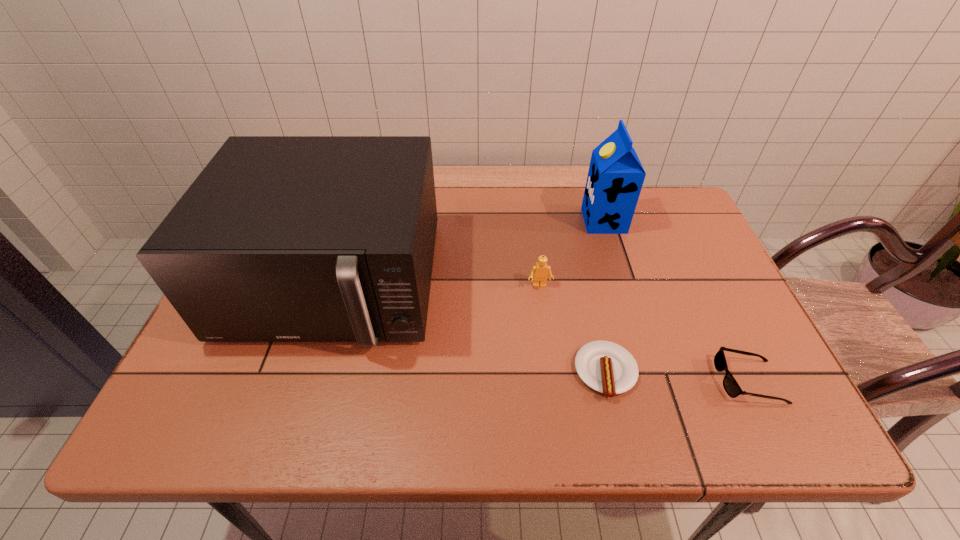
You are a GUI agent. You are given a task and a screenshot of the screen. Output one action in this format:
    pyautogui.click(x=<x>, y=<y>)
    Task: Click on the free location located on the front-facing side of the leftmost object
    
    Given the screenshot: What is the action you would take?
    pyautogui.click(x=302, y=383)

Where is `free space located on the face of the third tallest object`? Image resolution: width=960 pixels, height=540 pixels. free space located on the face of the third tallest object is located at coordinates (554, 399).

Locate an element on the screen. This screenshot has height=540, width=960. free space located on the front-facing side of the sunglasses is located at coordinates (544, 381).

Find the location of a particular element. vacant space located 0.260m on the front-facing side of the sunglasses is located at coordinates (596, 381).

You are a GUI agent. You are given a task and a screenshot of the screen. Output one action in this format:
    pyautogui.click(x=<x>, y=<y>)
    Task: Click on the vacant region located on the front-facing side of the sunglasses
    This screenshot has height=540, width=960.
    Given the screenshot: What is the action you would take?
    pyautogui.click(x=567, y=381)

The image size is (960, 540). Identify the location of vacant space located 0.190m on the left of the shortest object. (487, 372).

Where is `carton located in the far edge section of the desktop`? Image resolution: width=960 pixels, height=540 pixels. carton located in the far edge section of the desktop is located at coordinates (615, 178).

The width and height of the screenshot is (960, 540). In order to click on microwave oven located at the far edge in this screenshot , I will do tap(280, 238).

Locate an element on the screen. sunglasses that is at the near edge is located at coordinates (732, 388).

Where is `sausage situated at the near edge`? sausage situated at the near edge is located at coordinates (606, 367).